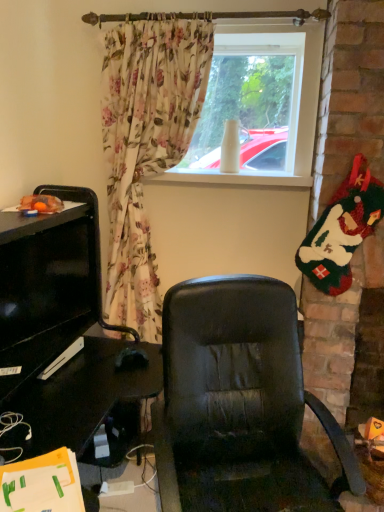
Question: From a real-world perspective, is black matte mouse at lower left located beneath white matte vase at upper center?

Choices:
 (A) yes
 (B) no

Answer: (A)

Question: Is black matte mouse at lower left thinner than white matte vase at upper center?

Choices:
 (A) no
 (B) yes

Answer: (A)

Question: From a real-world perspective, is black matte mouse at lower left over white matte vase at upper center?

Choices:
 (A) yes
 (B) no

Answer: (B)

Question: Can you confirm if black matte mouse at lower left is smaller than white matte vase at upper center?

Choices:
 (A) yes
 (B) no

Answer: (A)

Question: Is black matte mouse at lower left positioned behind white matte vase at upper center?

Choices:
 (A) no
 (B) yes

Answer: (A)

Question: Is black matte mouse at lower left positioned far away from white matte vase at upper center?

Choices:
 (A) no
 (B) yes

Answer: (B)

Question: Can you confirm if white matte vase at upper center is thinner than black matte mouse at lower left?

Choices:
 (A) yes
 (B) no

Answer: (A)

Question: Is white matte vase at upper center bigger than black matte mouse at lower left?

Choices:
 (A) yes
 (B) no

Answer: (A)

Question: From the image's perspective, does white matte vase at upper center appear lower than black matte mouse at lower left?

Choices:
 (A) yes
 (B) no

Answer: (B)

Question: From a real-world perspective, does white matte vase at upper center sit lower than black matte mouse at lower left?

Choices:
 (A) yes
 (B) no

Answer: (B)

Question: Can you confirm if white matte vase at upper center is positioned to the right of black matte mouse at lower left?

Choices:
 (A) yes
 (B) no

Answer: (A)

Question: Is white matte vase at upper center shorter than black matte mouse at lower left?

Choices:
 (A) yes
 (B) no

Answer: (B)

Question: Would you say white matte vase at upper center is inside or outside black matte mouse at lower left?

Choices:
 (A) inside
 (B) outside

Answer: (B)